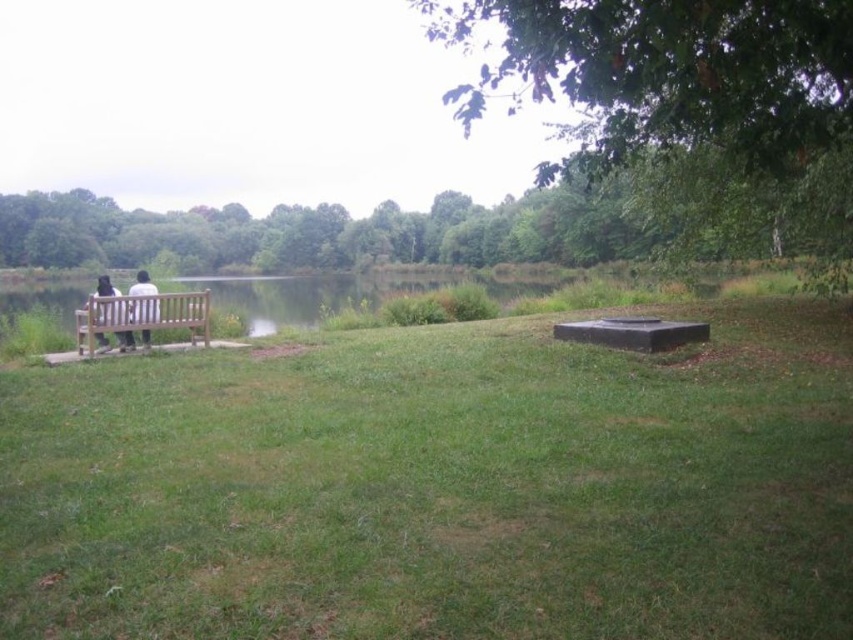
From the picture: Can you confirm if wooden bench at left is taller than dark brown leather jacket at left?

In fact, wooden bench at left may be shorter than dark brown leather jacket at left.

Between point (105, 300) and point (115, 291), which one is positioned behind?

The point (115, 291) is behind.

At what (x,y) coordinates should I click in order to perform the action: click on wooden bench at left. Please return your answer as a coordinate pair (x, y). The image size is (853, 640). Looking at the image, I should click on (144, 316).

In order to click on wooden bench at left in this screenshot , I will do coord(144,316).

Is green grassy at left taller than green leafy tree at upper center?

No, green grassy at left is not taller than green leafy tree at upper center.

Does green grassy at left appear on the right side of green leafy tree at upper center?

Indeed, green grassy at left is positioned on the right side of green leafy tree at upper center.

Is point (445, 435) positioned behind point (537, 189)?

No, it is not.

The height and width of the screenshot is (640, 853). In order to click on green grassy at left in this screenshot , I will do `click(438, 488)`.

Is green grassy at left bigger than dark brown leather jacket at left?

Correct, green grassy at left is larger in size than dark brown leather jacket at left.

Is point (816, 552) positioned after point (105, 317)?

No, it is not.

Find the location of a particular element. The height and width of the screenshot is (640, 853). green grassy at left is located at coordinates (438, 488).